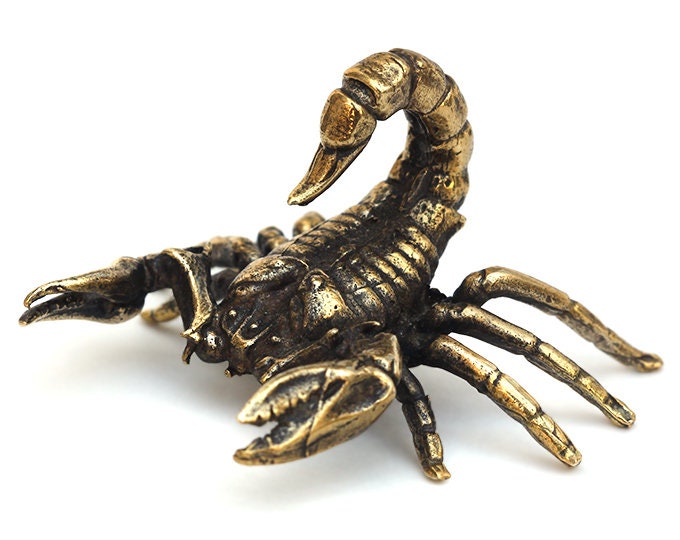
You are a GUI agent. You are given a task and a screenshot of the screen. Output one action in this format:
    pyautogui.click(x=<x>, y=<y>)
    Task: Click on the scropion figurine
    This screenshot has height=540, width=680.
    Given the screenshot: What is the action you would take?
    pyautogui.click(x=299, y=293)